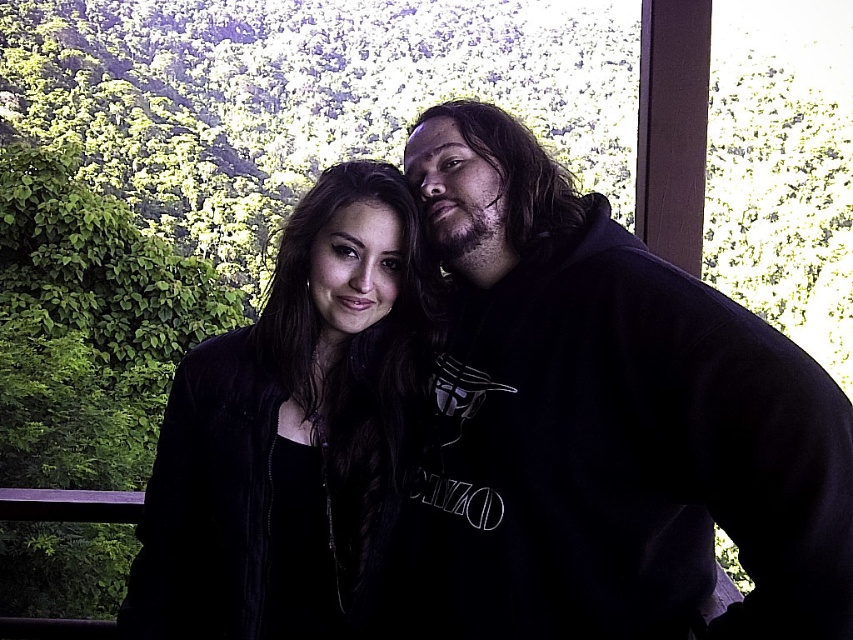
You are a tailor who needs to determine which garment requires more fabric to alter. You see the black hoodie at center and the black velvet jacket at center. Which one would need more fabric for alterations?

The black hoodie at center is larger in size than the black velvet jacket at center, so it would require more fabric for alterations.

You are standing on the balcony and want to place a small potted plant between the two points, point (659, 529) and point (383, 496). Which point should the plant be closer to in order to be nearer to the railing?

The plant should be closer to point (659, 529) because it is closer to the viewer than point (383, 496), and the railing is at the bottom left corner, so being closer to the viewer would place it nearer to the railing.